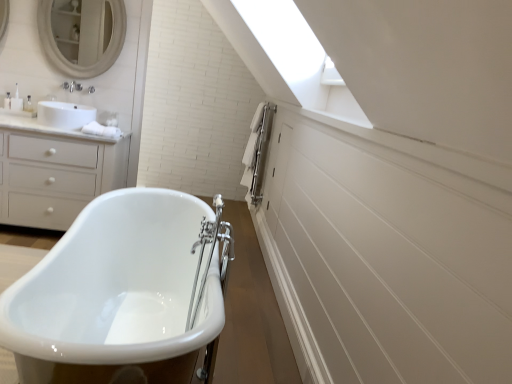
What is the approximate width of white matte chest of drawers at left?

21.26 inches.

Measure the distance between white glossy bathtub at center and camera.

The depth of white glossy bathtub at center is 99.30 centimeters.

Where is `white matte chest of drawers at left`? The image size is (512, 384). white matte chest of drawers at left is located at coordinates (55, 177).

Is white matte chest of drawers at left wider or thinner than white glossy bathtub at center?

Clearly, white matte chest of drawers at left has less width compared to white glossy bathtub at center.

Does white matte chest of drawers at left touch white glossy bathtub at center?

No.

Which is correct: white matte chest of drawers at left is inside white glossy bathtub at center, or outside of it?

white matte chest of drawers at left cannot be found inside white glossy bathtub at center.

From the image's perspective, is white glossy bathtub at center beneath white matte chest of drawers at left?

Yes, from the image's perspective, white glossy bathtub at center is below white matte chest of drawers at left.

In order to click on the chest of drawers that is above the white glossy bathtub at center (from the image's perspective) in this screenshot , I will do `click(55, 177)`.

Is white glossy bathtub at center closer to the viewer compared to white matte chest of drawers at left?

Yes, white glossy bathtub at center is in front of white matte chest of drawers at left.

From the picture: Considering the sizes of objects white matte chest of drawers at left and white matte mirror at upper left in the image provided, who is wider, white matte chest of drawers at left or white matte mirror at upper left?

Wider between the two is white matte chest of drawers at left.

Can you confirm if white matte chest of drawers at left is positioned to the right of white matte mirror at upper left?

No, white matte chest of drawers at left is not to the right of white matte mirror at upper left.

Locate an element on the screen. chest of drawers located on the left of white matte mirror at upper left is located at coordinates (55, 177).

Considering the positions of point (1, 138) and point (97, 22), is point (1, 138) closer or farther from the camera than point (97, 22)?

Clearly, point (1, 138) is closer to the camera than point (97, 22).

Is point (177, 358) positioned behind point (95, 22)?

No, (177, 358) is closer to viewer.

Choose the correct answer: Is white glossy bathtub at center inside white matte mirror at upper left or outside it?

white glossy bathtub at center is outside white matte mirror at upper left.

Does white glossy bathtub at center have a smaller size compared to white matte mirror at upper left?

No, white glossy bathtub at center is not smaller than white matte mirror at upper left.

Is white glossy bathtub at center oriented away from white matte mirror at upper left?

No.

In the scene shown: Considering the positions of objects white matte mirror at upper left and white matte chest of drawers at left in the image provided, who is behind, white matte mirror at upper left or white matte chest of drawers at left?

white matte mirror at upper left is more distant.

From the image's perspective, would you say white matte mirror at upper left is positioned over white matte chest of drawers at left?

Yes.

Can you tell me how much white matte mirror at upper left and white matte chest of drawers at left differ in facing direction?

The facing directions of white matte mirror at upper left and white matte chest of drawers at left are 0.000645 degrees apart.

Is white matte mirror at upper left to the right of white matte chest of drawers at left from the viewer's perspective?

Correct, you'll find white matte mirror at upper left to the right of white matte chest of drawers at left.

Is white matte mirror at upper left oriented towards white glossy bathtub at center?

No, white matte mirror at upper left does not turn towards white glossy bathtub at center.

Between point (65, 10) and point (151, 372), which one is positioned behind?

The point (65, 10) is farther.

Is white matte mirror at upper left situated inside white glossy bathtub at center or outside?

white matte mirror at upper left is spatially situated outside white glossy bathtub at center.

Where is `the chest of drawers lying above the white glossy bathtub at center (from the image's perspective)`? the chest of drawers lying above the white glossy bathtub at center (from the image's perspective) is located at coordinates (55, 177).

The height and width of the screenshot is (384, 512). Find the location of `bathtub below the white matte chest of drawers at left (from a real-world perspective)`. bathtub below the white matte chest of drawers at left (from a real-world perspective) is located at coordinates (117, 295).

Looking at the image, which one is located further to white matte mirror at upper left, white glossy bathtub at center or white matte chest of drawers at left?

The object further to white matte mirror at upper left is white glossy bathtub at center.

Which object lies further to the anchor point white matte chest of drawers at left, white matte mirror at upper left or white glossy bathtub at center?

white glossy bathtub at center lies further to white matte chest of drawers at left than the other object.

From the image, which object appears to be nearer to white glossy bathtub at center, white matte mirror at upper left or white matte chest of drawers at left?

white matte chest of drawers at left lies closer to white glossy bathtub at center than the other object.

Estimate the real-world distances between objects in this image. Which object is closer to white matte chest of drawers at left, white glossy bathtub at center or white matte mirror at upper left?

white matte mirror at upper left lies closer to white matte chest of drawers at left than the other object.

From the image, which object appears to be farther from white matte mirror at upper left, white matte chest of drawers at left or white glossy bathtub at center?

Based on the image, white glossy bathtub at center appears to be further to white matte mirror at upper left.

Estimate the real-world distances between objects in this image. Which object is further from white glossy bathtub at center, white matte chest of drawers at left or white matte mirror at upper left?

white matte mirror at upper left is further to white glossy bathtub at center.

What are the coordinates of `the chest of drawers positioned between white glossy bathtub at center and white matte mirror at upper left from near to far` in the screenshot? It's located at (55, 177).